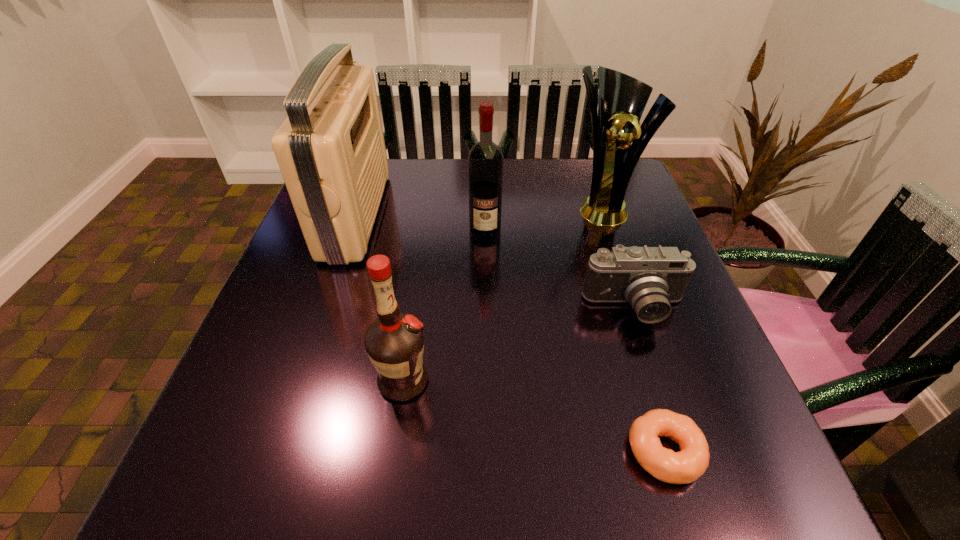
I want to click on free space at the near right corner of the desktop, so click(x=728, y=497).

What are the coordinates of `free space between the fifth object from right to left and the third nearest object` in the screenshot? It's located at (519, 345).

I want to click on unoccupied position between the fourth farthest object and the leftmost object, so click(495, 262).

The height and width of the screenshot is (540, 960). What are the coordinates of `vacant space that's between the leftmost object and the third nearest object` in the screenshot? It's located at (495, 262).

Locate an element on the screen. vacant area that lies between the radio receiver and the nearest object is located at coordinates (510, 333).

Locate an element on the screen. empty location between the liquor and the fourth object from right to left is located at coordinates (444, 305).

At what (x,y) coordinates should I click in order to perform the action: click on free spot between the fourth farthest object and the liquor. Please return your answer as a coordinate pair (x, y). Looking at the image, I should click on tap(519, 345).

Where is `free space between the fourth object from right to left and the award`? free space between the fourth object from right to left and the award is located at coordinates (543, 218).

Find the location of a particular element. Image resolution: width=960 pixels, height=540 pixels. vacant area that lies between the second object from left to right and the award is located at coordinates (502, 294).

Image resolution: width=960 pixels, height=540 pixels. Find the location of `the third closest object to the fourth object from right to left`. the third closest object to the fourth object from right to left is located at coordinates (649, 278).